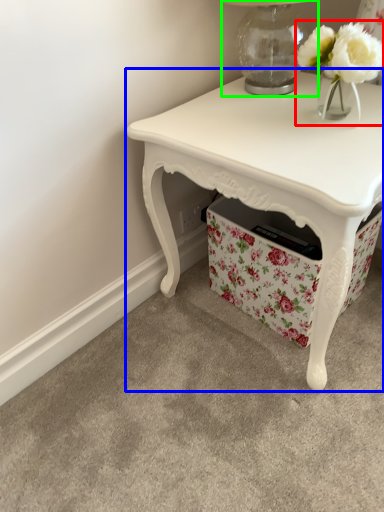
Question: Considering the real-world distances, which object is closest to floral arrangement (highlighted by a red box)? table (highlighted by a blue box) or table lamp (highlighted by a green box).

Choices:
 (A) table
 (B) table lamp

Answer: (B)